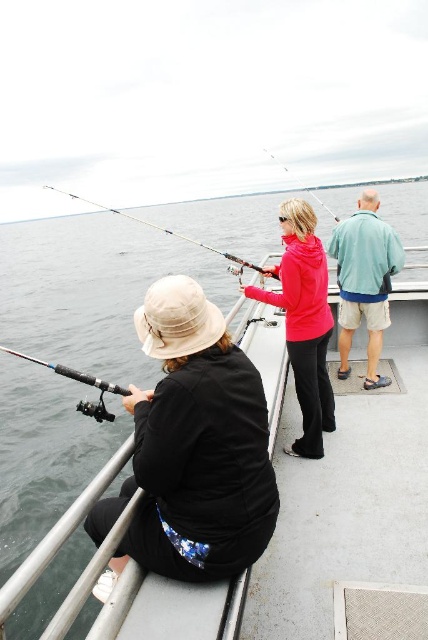
Can you confirm if black matte jacket at lower left is positioned below black matte fishing pole at left?

Indeed, black matte jacket at lower left is positioned under black matte fishing pole at left.

Who is positioned more to the right, black matte jacket at lower left or black matte fishing pole at left?

Positioned to the right is black matte jacket at lower left.

Measure the distance between black matte jacket at lower left and camera.

black matte jacket at lower left is 1.94 meters from camera.

Where is `black matte jacket at lower left`? The image size is (428, 640). black matte jacket at lower left is located at coordinates (193, 449).

Who is lower down, teal fabric jacket at upper right or black matte fishing pole at left?

black matte fishing pole at left

Is point (356, 259) closer to camera compared to point (80, 372)?

No.

Identify the location of teal fabric jacket at upper right. (365, 280).

Who is shorter, shiny metallic rod at center or black matte fishing pole at left?

Standing shorter between the two is black matte fishing pole at left.

Is the position of shiny metallic rod at center more distant than that of black matte fishing pole at left?

That is True.

Locate an element on the screen. The height and width of the screenshot is (640, 428). shiny metallic rod at center is located at coordinates (171, 234).

This screenshot has width=428, height=640. What are the coordinates of `shiny metallic rod at center` in the screenshot? It's located at (171, 234).